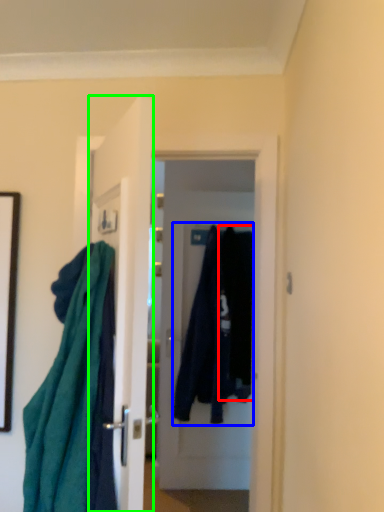
Question: Which object is the closest to the clothing (highlighted by a red box)? Choose among these: clothing (highlighted by a blue box) or door (highlighted by a green box).

Choices:
 (A) clothing
 (B) door

Answer: (A)